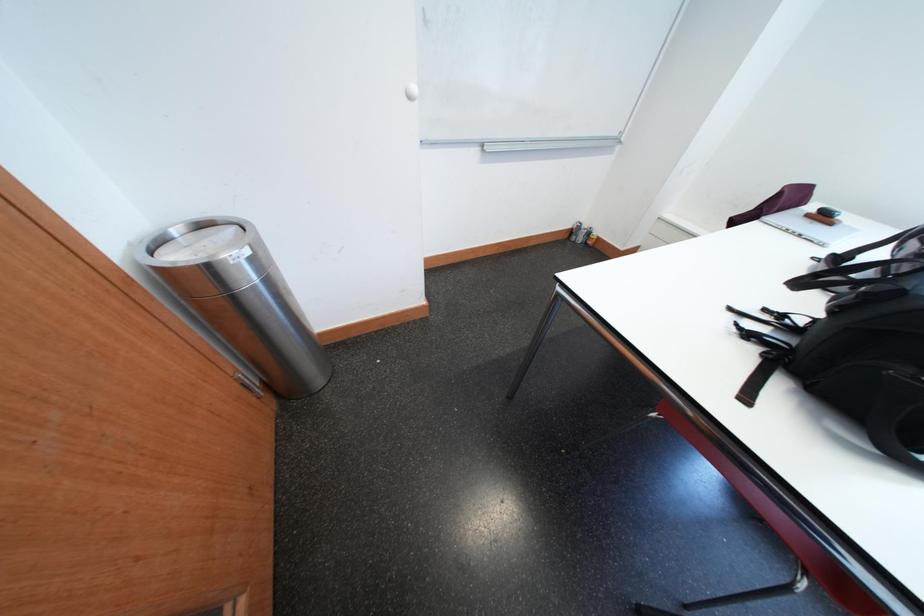
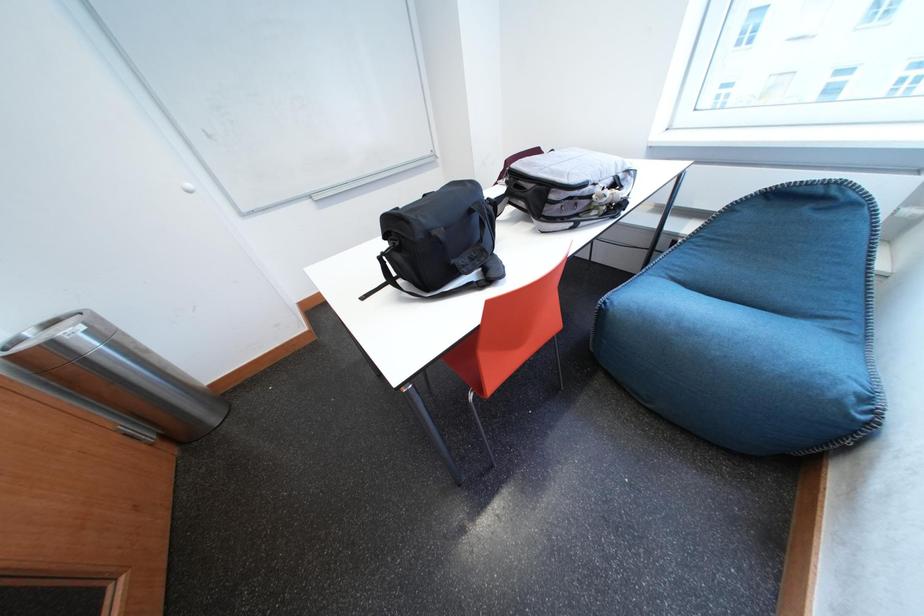
From the picture: The images are taken continuously from a first-person perspective. In which direction are you moving?

The cameraman walked toward right, backward.